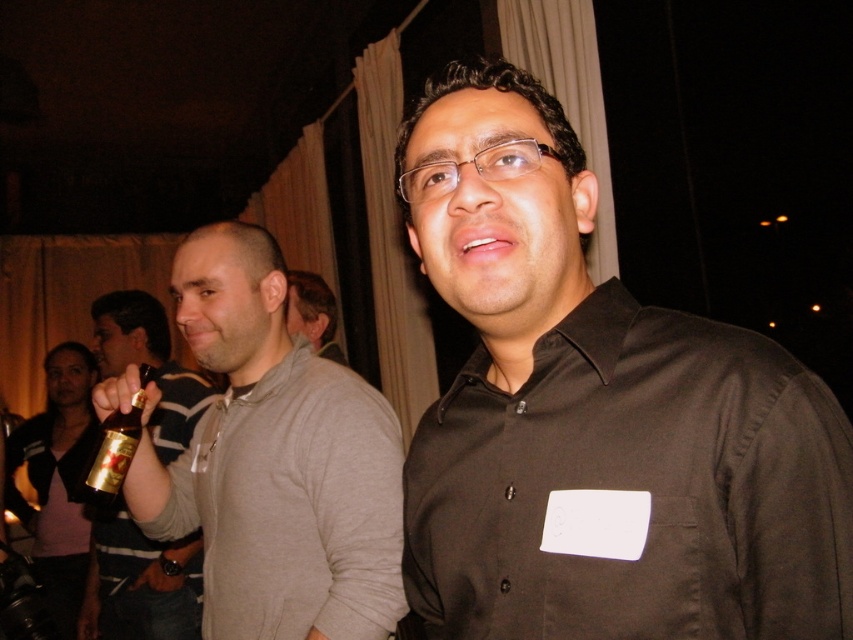
Question: Which object is farther from the camera taking this photo?

Choices:
 (A) gold metallic bottle at center
 (B) gold metallic bottle at left
 (C) black matte shirt at center
 (D) gray cotton sweater at left

Answer: (B)

Question: Can you confirm if black matte shirt at center is thinner than gold metallic beer can at left?

Choices:
 (A) yes
 (B) no

Answer: (A)

Question: From the image, what is the correct spatial relationship of black matte shirt at center in relation to gray cotton sweater at left?

Choices:
 (A) left
 (B) right

Answer: (B)

Question: Does black matte shirt at center have a greater width compared to gold metallic bottle at left?

Choices:
 (A) no
 (B) yes

Answer: (A)

Question: Which object is farther from the camera taking this photo?

Choices:
 (A) black matte shirt at center
 (B) gray cotton sweater at left
 (C) gold metallic bottle at center
 (D) gold metallic bottle at left

Answer: (D)

Question: Which object is positioned farthest from the light brown sweater at center?

Choices:
 (A) gold metallic bottle at left
 (B) gray cotton sweater at left
 (C) gold metallic beer can at left
 (D) gold metallic bottle at center

Answer: (D)